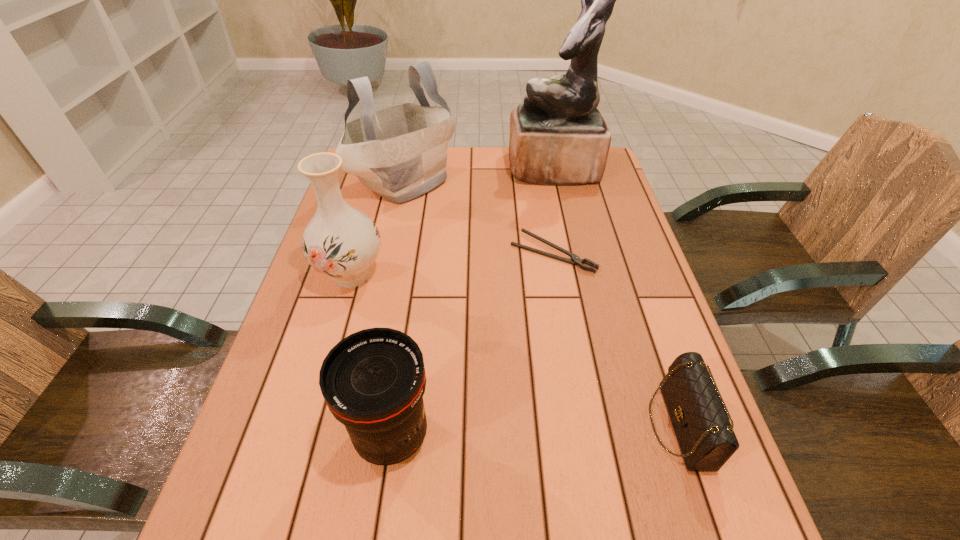
Find the location of a particular element. The width and height of the screenshot is (960, 540). free area in between the fifth tallest object and the fourth tallest object is located at coordinates (536, 430).

What are the coordinates of `free space between the telephoto lens and the tallest object` in the screenshot? It's located at (472, 302).

Where is `free point between the vase and the sculpture`? free point between the vase and the sculpture is located at coordinates (452, 221).

Where is `free spot between the tongs and the vase`? Image resolution: width=960 pixels, height=540 pixels. free spot between the tongs and the vase is located at coordinates (452, 264).

At what (x,y) coordinates should I click in order to perform the action: click on unoccupied area between the shopping bag and the tallest object. Please return your answer as a coordinate pair (x, y). Looking at the image, I should click on (479, 175).

I want to click on free space between the clutch bag and the shopping bag, so click(542, 303).

Where is `free space between the second shortest object and the vase`? free space between the second shortest object and the vase is located at coordinates (516, 350).

At what (x,y) coordinates should I click in order to perform the action: click on free point between the vase and the tallest object. Please return your answer as a coordinate pair (x, y). Image resolution: width=960 pixels, height=540 pixels. Looking at the image, I should click on (452, 221).

I want to click on object that is the fourth closest to the tallest object, so click(x=699, y=416).

Locate an element on the screen. This screenshot has height=540, width=960. object that stands as the fifth closest to the shopping bag is located at coordinates (699, 416).